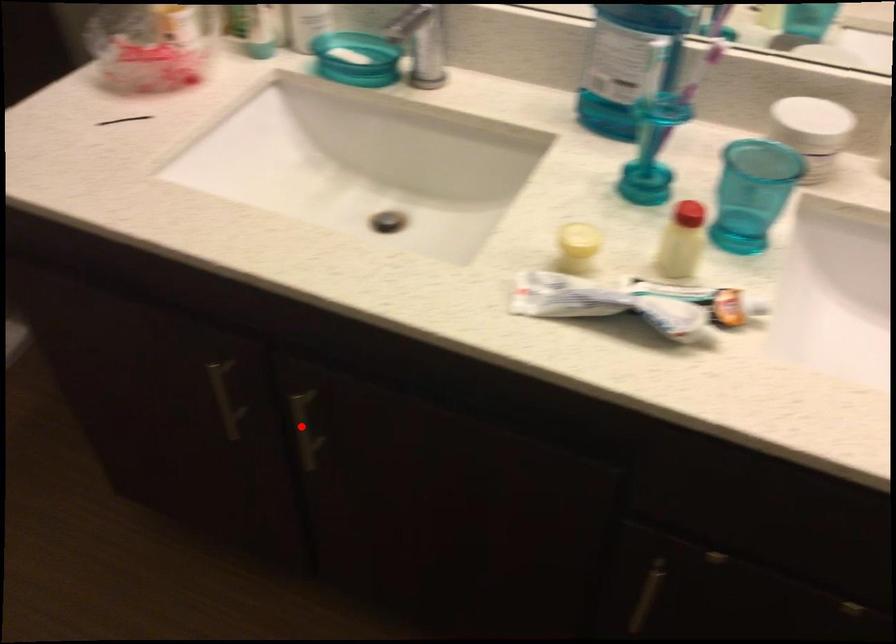
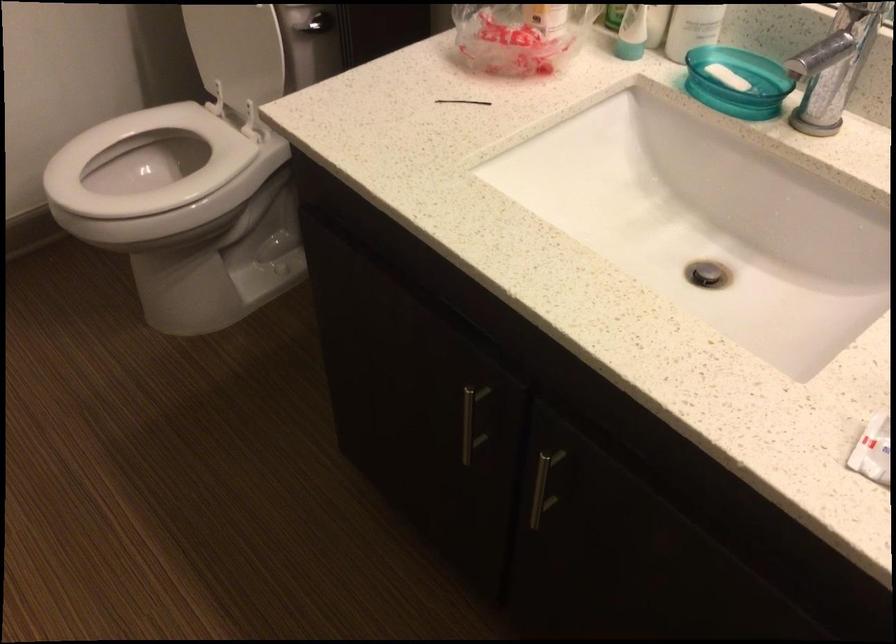
Question: I am providing you with two images of the same scene from different viewpoints. Image1 has a red point marked. In image2, the corresponding 3D location appears at what relative position? Reply with the corresponding letter.

Choices:
 (A) Closer
 (B) Farther

Answer: (A)